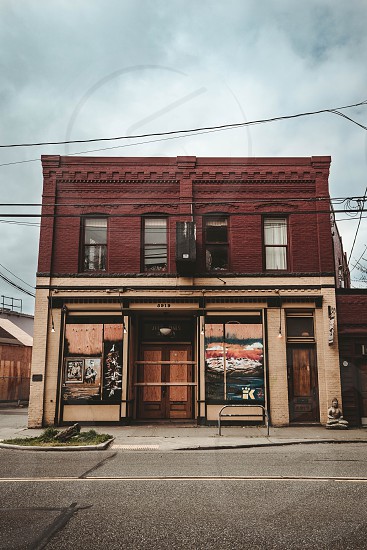
Where is `buddha statue`? buddha statue is located at coordinates (336, 416).